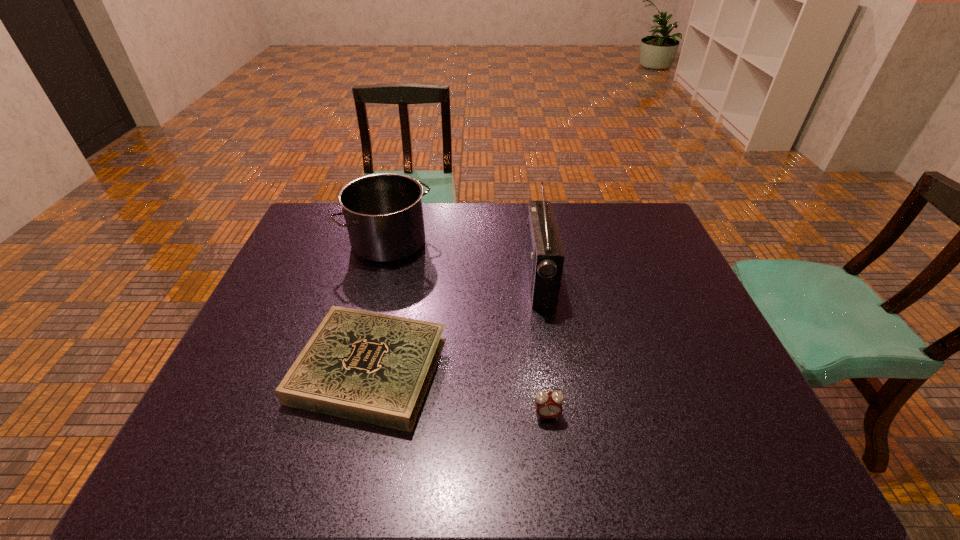
Identify the location of empty space between the second shortest object and the tallest object. (543, 346).

This screenshot has height=540, width=960. What are the coordinates of `vacant region between the saucepan and the radio receiver` in the screenshot? It's located at (464, 260).

Locate an element on the screen. The width and height of the screenshot is (960, 540). unoccupied area between the hardback book and the alarm clock is located at coordinates (459, 392).

This screenshot has width=960, height=540. Find the location of `vacant area between the third shortest object and the radio receiver`. vacant area between the third shortest object and the radio receiver is located at coordinates (464, 260).

Where is `free space that is in between the radio receiver and the hardback book`? Image resolution: width=960 pixels, height=540 pixels. free space that is in between the radio receiver and the hardback book is located at coordinates (455, 323).

You are a GUI agent. You are given a task and a screenshot of the screen. Output one action in this format:
    pyautogui.click(x=<x>, y=<y>)
    Task: Click on the unoccupied area between the third tallest object and the hardback book
    
    Given the screenshot: What is the action you would take?
    pyautogui.click(x=459, y=392)

Locate an element on the screen. This screenshot has width=960, height=540. object identified as the third closest to the radio receiver is located at coordinates (383, 212).

Select which object appears as the closest to the third shortest object. Please provide its 2D coordinates. Your answer should be formatted as a tuple, i.e. [(x, y)], where the tuple contains the x and y coordinates of a point satisfying the conditions above.

[(375, 368)]

Find the location of a particular element. This screenshot has width=960, height=540. free space that satisfies the following two spatial constraints: 1. on the front-facing side of the tallest object; 2. on the clock face of the alarm clock is located at coordinates (561, 415).

You are a GUI agent. You are given a task and a screenshot of the screen. Output one action in this format:
    pyautogui.click(x=<x>, y=<y>)
    Task: Click on the vacant space that satisfies the following two spatial constraints: 1. on the front-facing side of the tallest object; 2. on the clock face of the alarm clock
    Image resolution: width=960 pixels, height=540 pixels.
    Given the screenshot: What is the action you would take?
    pyautogui.click(x=561, y=415)